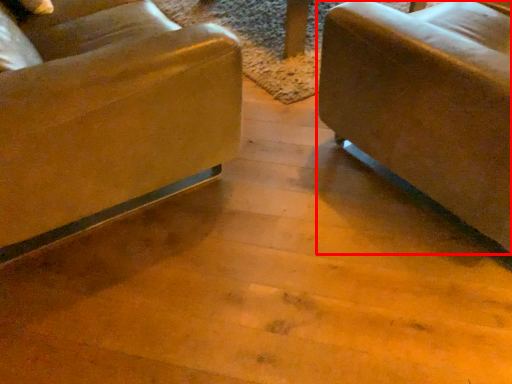
Question: In this image, where is studio couch (annotated by the red box) located relative to chair?

Choices:
 (A) right
 (B) left

Answer: (A)